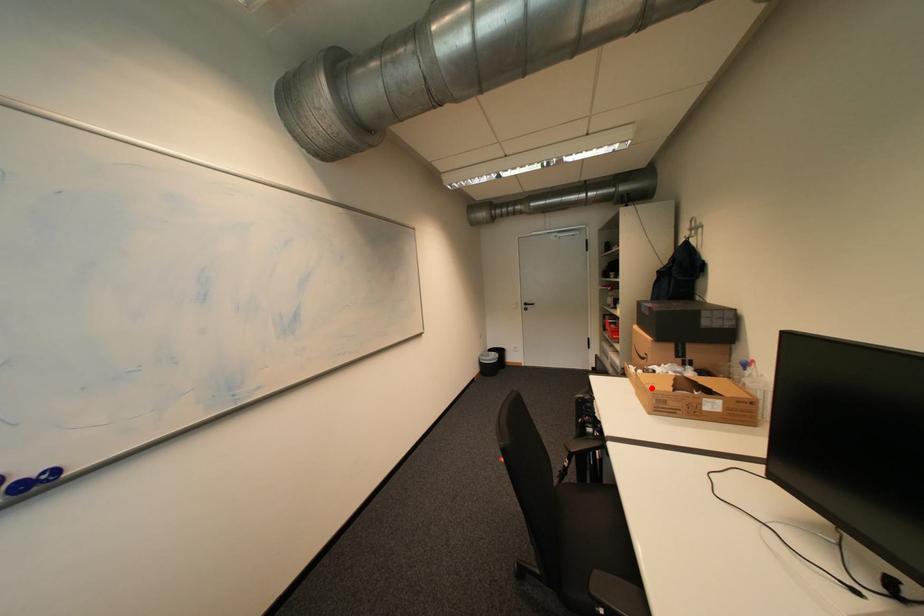
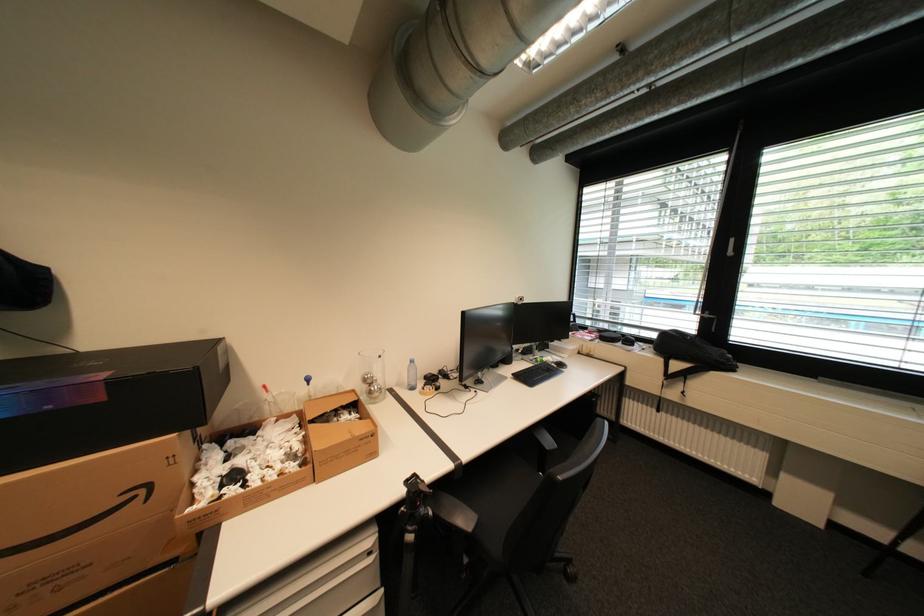
The point at the highlighted location is marked in the first image. Where is the corresponding point in the second image?

(370, 440)